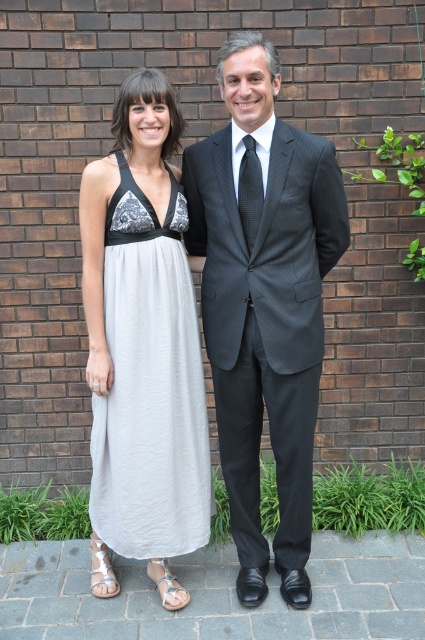
Does dark gray suit at center have a larger size compared to light gray cotton dress at center?

Indeed, dark gray suit at center has a larger size compared to light gray cotton dress at center.

Who is more distant from viewer, (299, 330) or (181, 328)?

The point (181, 328) is more distant.

The image size is (425, 640). What do you see at coordinates (263, 301) in the screenshot?
I see `dark gray suit at center` at bounding box center [263, 301].

The image size is (425, 640). Identify the location of dark gray suit at center. tap(263, 301).